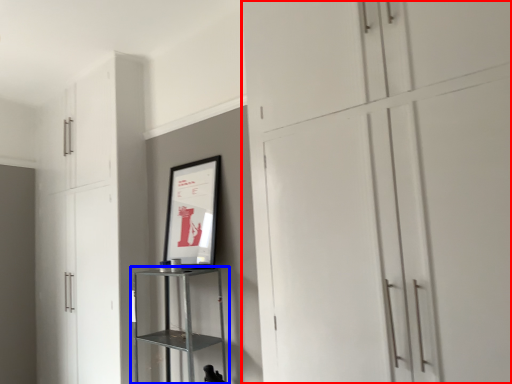
Question: Which object is further to the camera taking this photo, cupboard (highlighted by a red box) or shelf (highlighted by a blue box)?

Choices:
 (A) cupboard
 (B) shelf

Answer: (B)